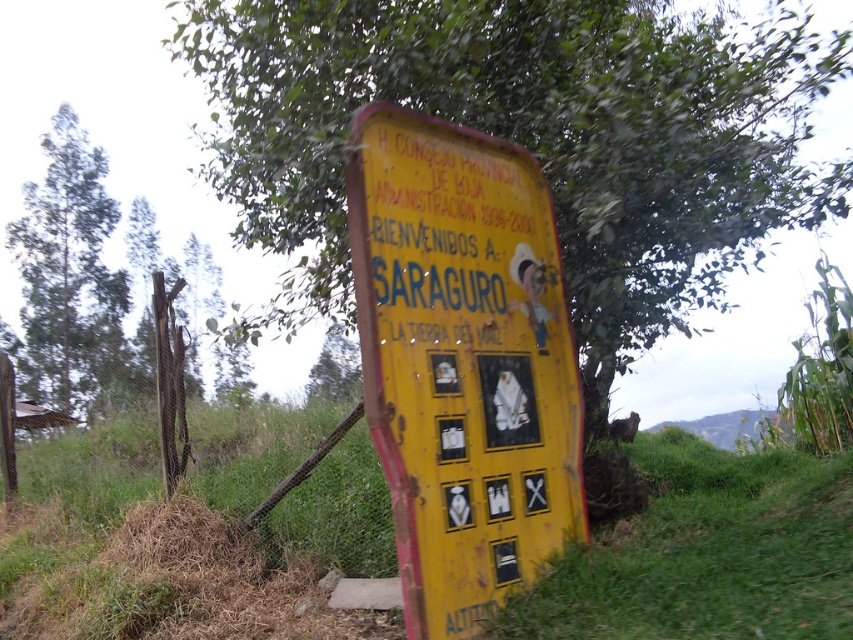
Which is more to the left, yellow painted wood sign at center or green leafy tree at left?

Positioned to the left is green leafy tree at left.

Which is above, yellow painted wood sign at center or green leafy tree at left?

green leafy tree at left

Who is more forward, (392, 218) or (96, 298)?

Point (392, 218) is more forward.

The width and height of the screenshot is (853, 640). I want to click on yellow painted wood sign at center, so click(x=462, y=362).

Does green leafy tree at center have a smaller size compared to green leafy tree at left?

No, green leafy tree at center is not smaller than green leafy tree at left.

Locate an element on the screen. The height and width of the screenshot is (640, 853). green leafy tree at center is located at coordinates (529, 140).

Who is lower down, green leafy tree at center or yellow painted wood sign at center?

Positioned lower is yellow painted wood sign at center.

Between point (601, 65) and point (457, 554), which one is positioned in front?

Point (457, 554) is more forward.

Locate an element on the screen. The image size is (853, 640). green leafy tree at center is located at coordinates (529, 140).